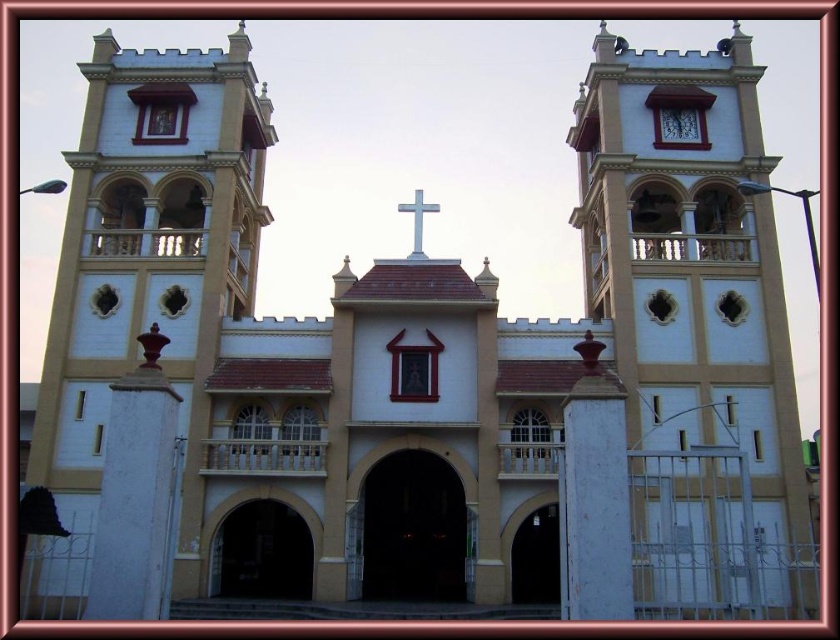
You are standing in front of the church and want to take a photo of the matte white tower at center. If your camera has a maximum zoom range of 50 meters, will you need to move closer to capture the tower in focus?

The matte white tower at center is 55.26 meters away from the viewer, which exceeds the camera maximum zoom range of 50 meters. Therefore, you need to move closer to capture the tower in focus.

You are a painter standing in front of the church. You need to paint both the matte white tower at center and the matte white clock at upper center. Which object requires more paint due to its larger size?

The matte white tower at center requires more paint because it is wider than the matte white clock at upper center.